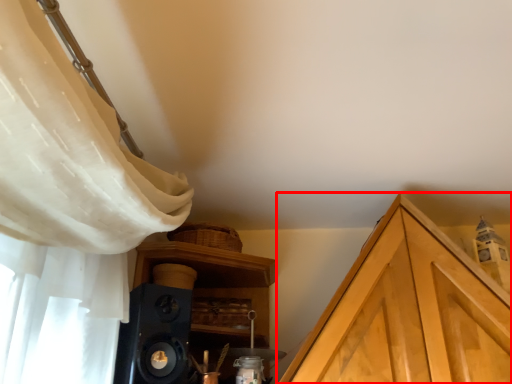
Question: From the image's perspective, considering the relative positions of cabinetry (annotated by the red box) and speaker in the image provided, where is cabinetry (annotated by the red box) located with respect to the staircase?

Choices:
 (A) below
 (B) above

Answer: (A)